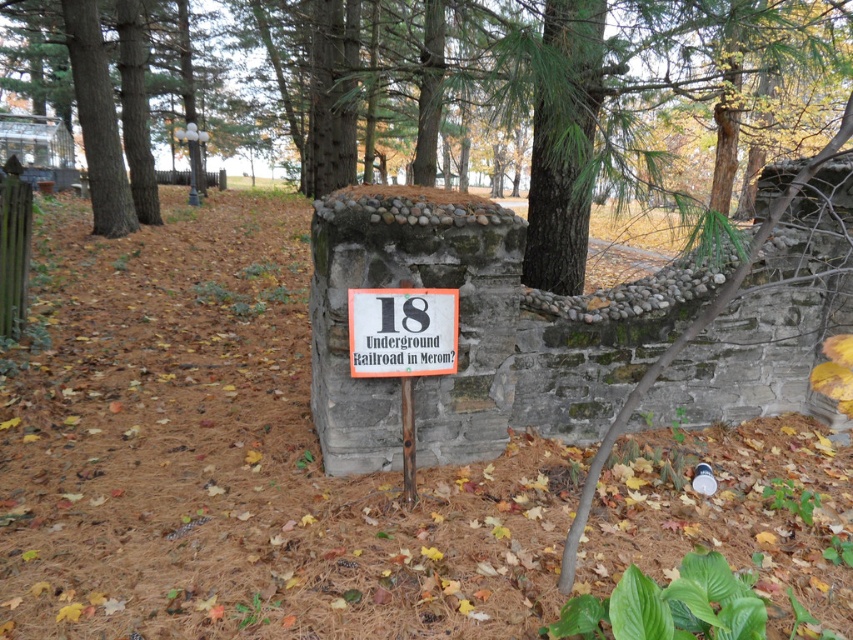
You are a visitor at this historical site and want to take a photo of both the green textured stone wall at center and the white plastic sign at center. Which object should you focus on first to ensure both are in the frame?

You should focus on the white plastic sign at center first because the green textured stone wall at center is located above it. By centering the sign in your viewfinder, you can adjust your camera angle upward to include the stone wall without losing the sign from the frame.